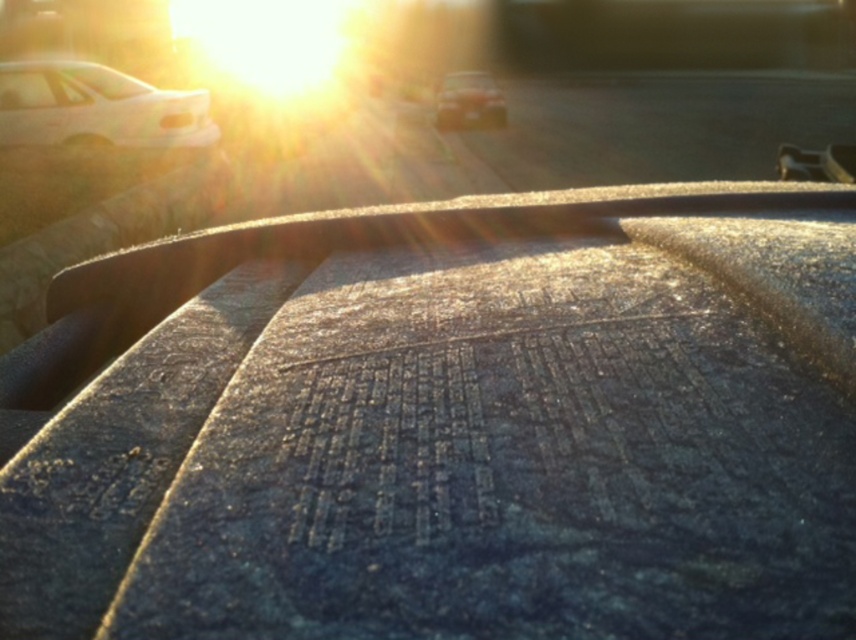
Question: Considering the relative positions of white matte car at left and metallic silver car at center in the image provided, where is white matte car at left located with respect to metallic silver car at center?

Choices:
 (A) below
 (B) above

Answer: (A)

Question: Is white matte car at left positioned behind metallic silver car at center?

Choices:
 (A) yes
 (B) no

Answer: (B)

Question: Is white matte car at left below metallic silver car at center?

Choices:
 (A) no
 (B) yes

Answer: (B)

Question: Among these objects, which one is nearest to the camera?

Choices:
 (A) metallic silver car at center
 (B) white matte car at left

Answer: (B)

Question: Which of the following is the closest to the observer?

Choices:
 (A) white matte car at left
 (B) metallic silver car at center

Answer: (A)